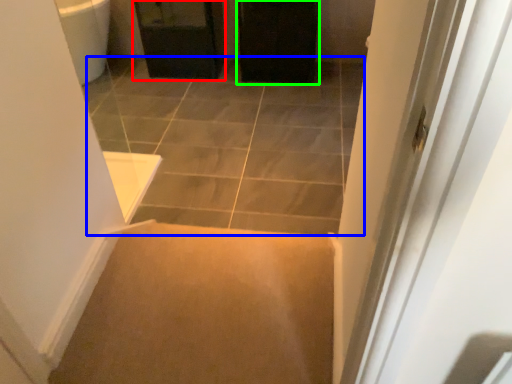
Question: Estimate the real-world distances between objects in this image. Which object is closer to cabinetry (highlighted by a red box), path (highlighted by a blue box) or screen door (highlighted by a green box)?

Choices:
 (A) path
 (B) screen door

Answer: (B)